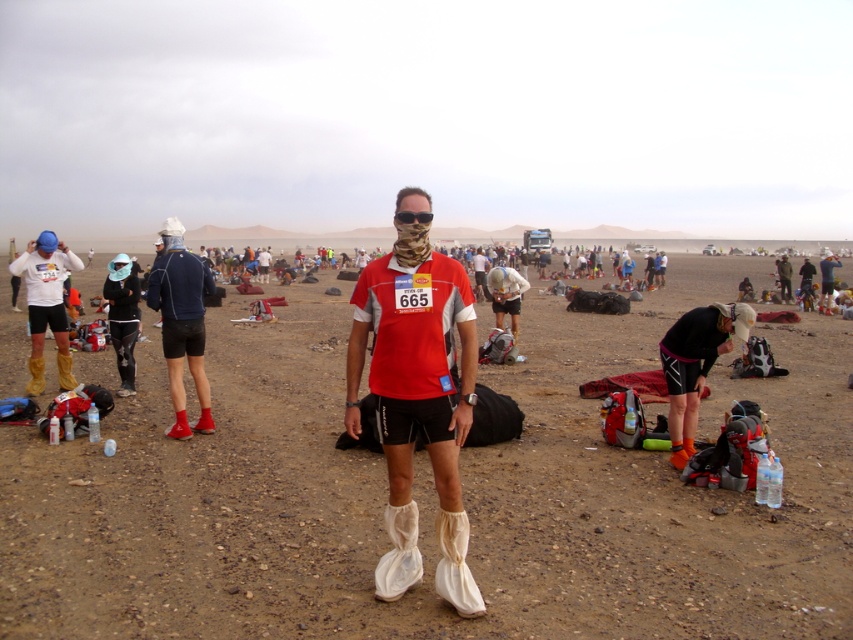
Question: Can you confirm if matte red shirt at center is bigger than black matte jacket at left?

Choices:
 (A) no
 (B) yes

Answer: (A)

Question: Estimate the real-world distances between objects in this image. Which object is closer to the black matte jacket at left?

Choices:
 (A) matte red shirt at center
 (B) brown sandy dirt at center

Answer: (A)

Question: Does orange fabric shorts at lower right appear on the right side of matte yellow boots at left?

Choices:
 (A) yes
 (B) no

Answer: (A)

Question: Which point is farther from the camera taking this photo?

Choices:
 (A) (671, 417)
 (B) (177, 256)
 (C) (387, 301)
 (D) (103, 616)

Answer: (B)

Question: Is brown sandy dirt at center smaller than black matte jacket at left?

Choices:
 (A) yes
 (B) no

Answer: (B)

Question: Which of these objects is positioned farthest from the brown sandy dirt at center?

Choices:
 (A) matte blue jacket at left
 (B) orange fabric shorts at lower right
 (C) matte red shirt at center

Answer: (A)